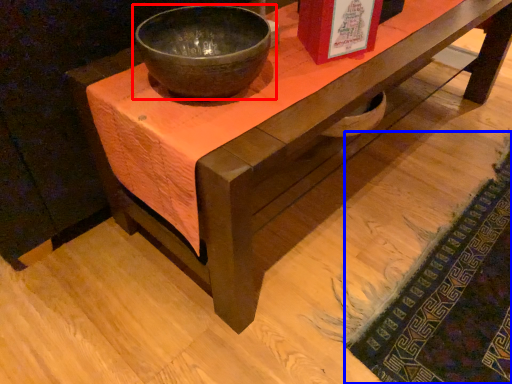
Question: Which object is closer to the camera taking this photo, bowl (highlighted by a red box) or mat (highlighted by a blue box)?

Choices:
 (A) bowl
 (B) mat

Answer: (A)